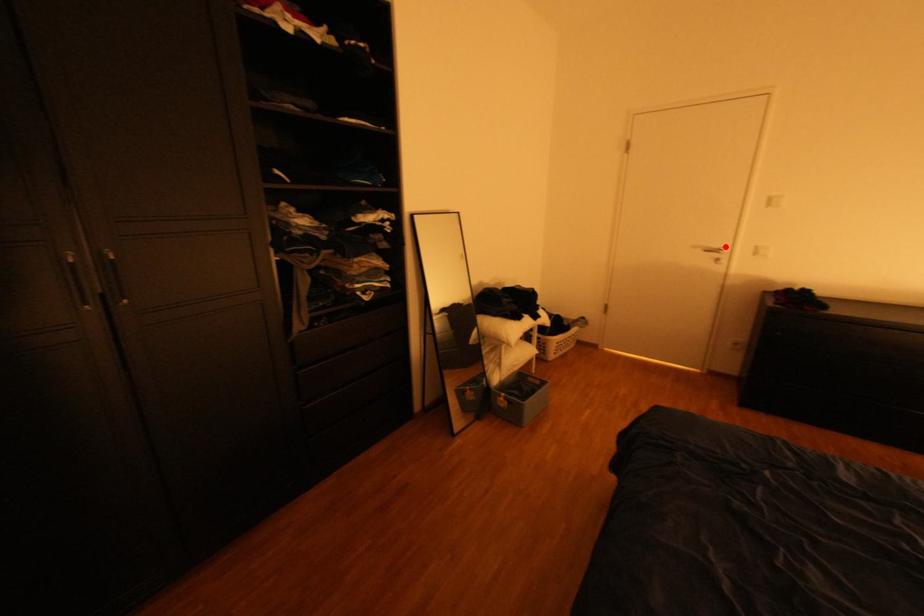
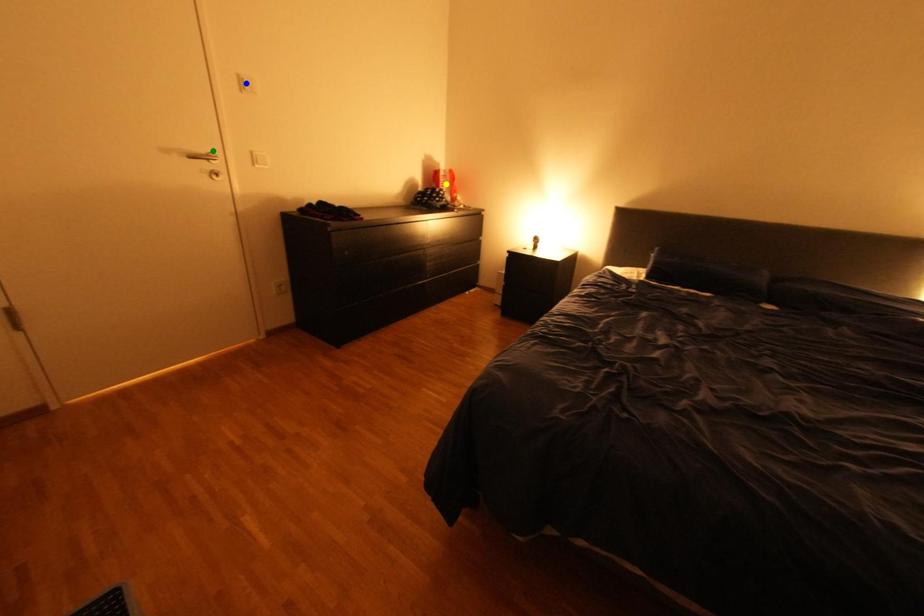
Question: I am providing you with two images of the same scene from different viewpoints. A red point is marked on the first image. You are given multiple points on the second image. Which spot in image 2 lines up with the point in image 1?

Choices:
 (A) yellow point
 (B) green point
 (C) blue point

Answer: (B)